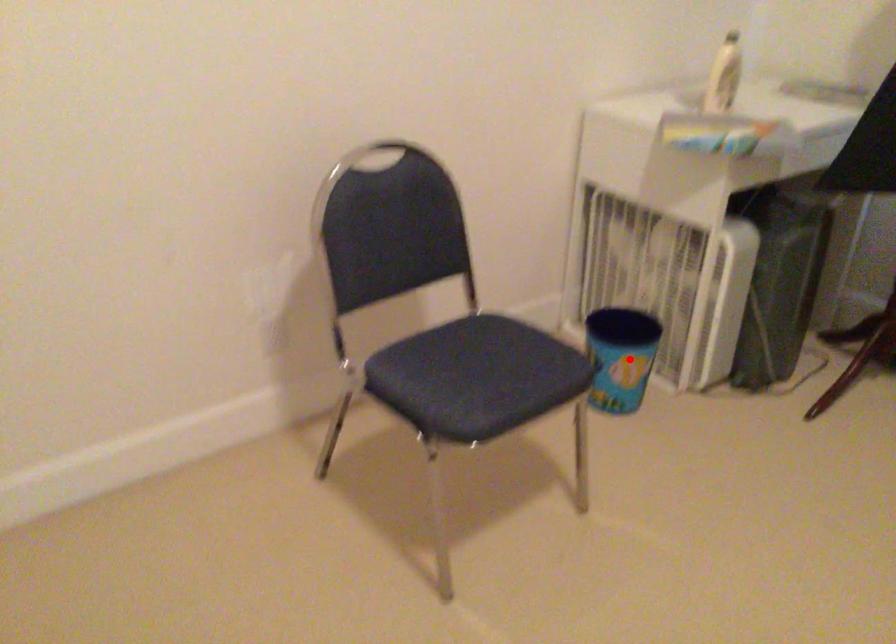
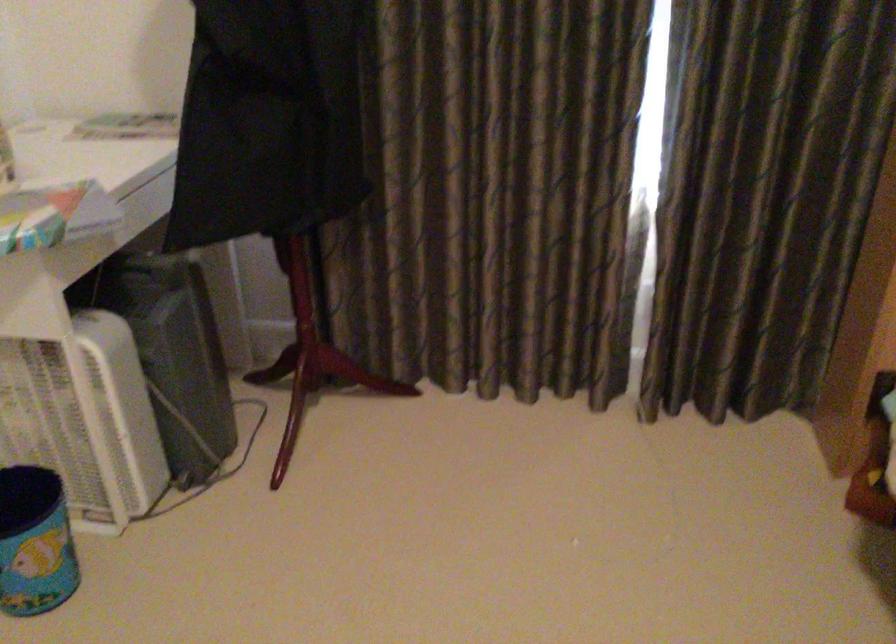
Question: I am providing you with two images of the same scene from different viewpoints. Given a red point in image1, look at the same physical point in image2. Is it:

Choices:
 (A) Closer to the viewpoint
 (B) Farther from the viewpoint

Answer: (A)